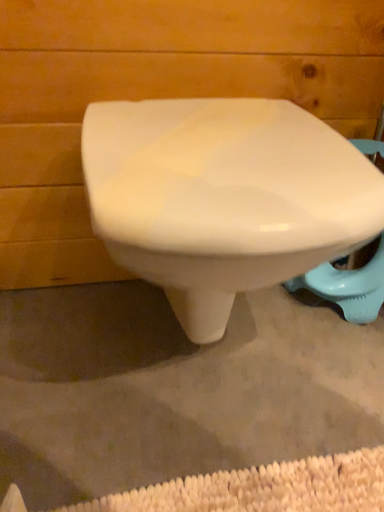
Question: Should I look upward or downward to see white glossy toilet at center?

Choices:
 (A) down
 (B) up

Answer: (B)